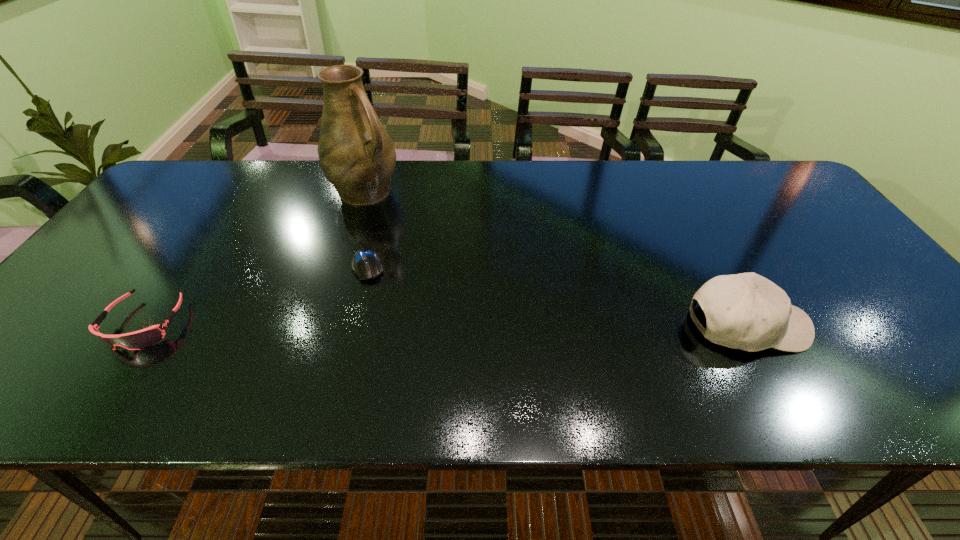
Where is `vacant space in between the baseball cap and the pitcher`? This screenshot has width=960, height=540. vacant space in between the baseball cap and the pitcher is located at coordinates (556, 258).

This screenshot has width=960, height=540. I want to click on empty location between the baseball cap and the leftmost object, so click(446, 324).

Identify the location of free space between the leftmost object and the second tallest object. This screenshot has width=960, height=540. (446, 324).

Locate an element on the screen. Image resolution: width=960 pixels, height=540 pixels. free space between the second farthest object and the pitcher is located at coordinates (367, 228).

At what (x,y) coordinates should I click in order to perform the action: click on object that ranks as the second closest to the goggles. Please return your answer as a coordinate pair (x, y). Looking at the image, I should click on (357, 156).

This screenshot has width=960, height=540. I want to click on object that is the closest to the second tallest object, so click(365, 264).

I want to click on vacant position in the image that satisfies the following two spatial constraints: 1. on the front-facing side of the third shortest object; 2. on the front-facing side of the leftmost object, so click(144, 325).

This screenshot has height=540, width=960. I want to click on blank area in the image that satisfies the following two spatial constraints: 1. on the front-facing side of the second shortest object; 2. on the front-facing side of the third shortest object, so click(x=144, y=325).

Where is `free region that satisfies the following two spatial constraints: 1. on the front-facing side of the rightmost object; 2. on the front-facing side of the leftmost object`? The height and width of the screenshot is (540, 960). free region that satisfies the following two spatial constraints: 1. on the front-facing side of the rightmost object; 2. on the front-facing side of the leftmost object is located at coordinates (144, 325).

Identify the location of vacant space that satisfies the following two spatial constraints: 1. on the front side of the baseball cap; 2. on the front-facing side of the farthest object. The width and height of the screenshot is (960, 540). (322, 325).